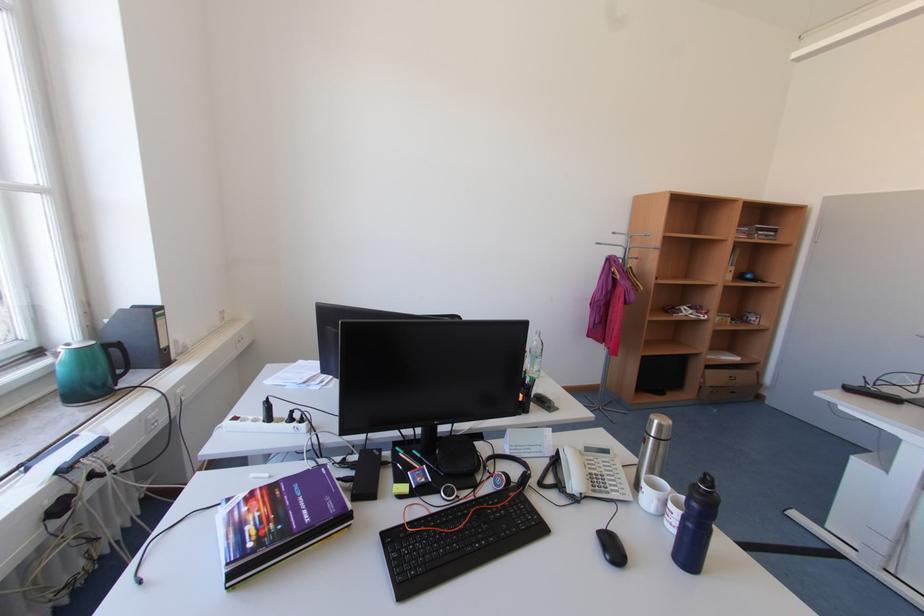
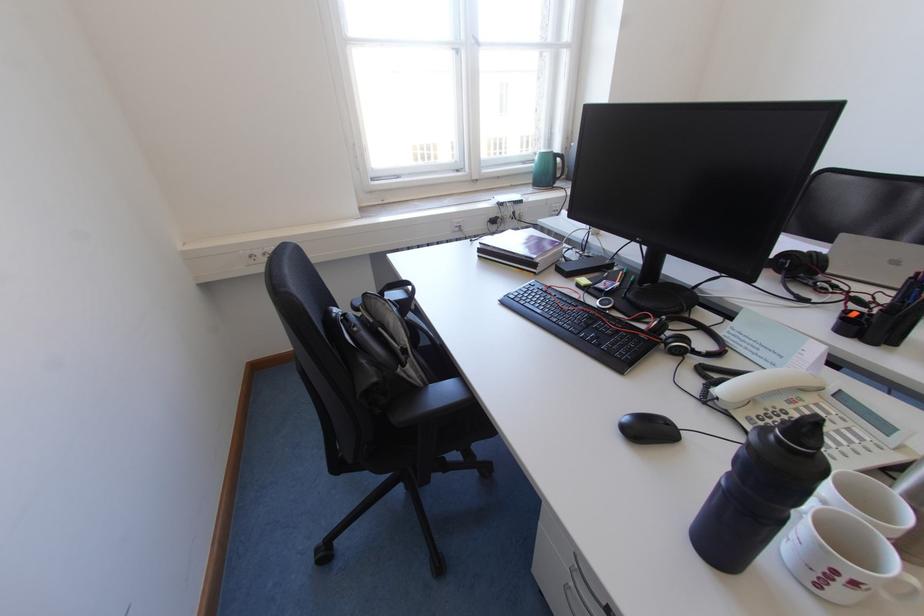
In the second image, find the point that corresponds to (566,487) in the first image.

(723, 384)